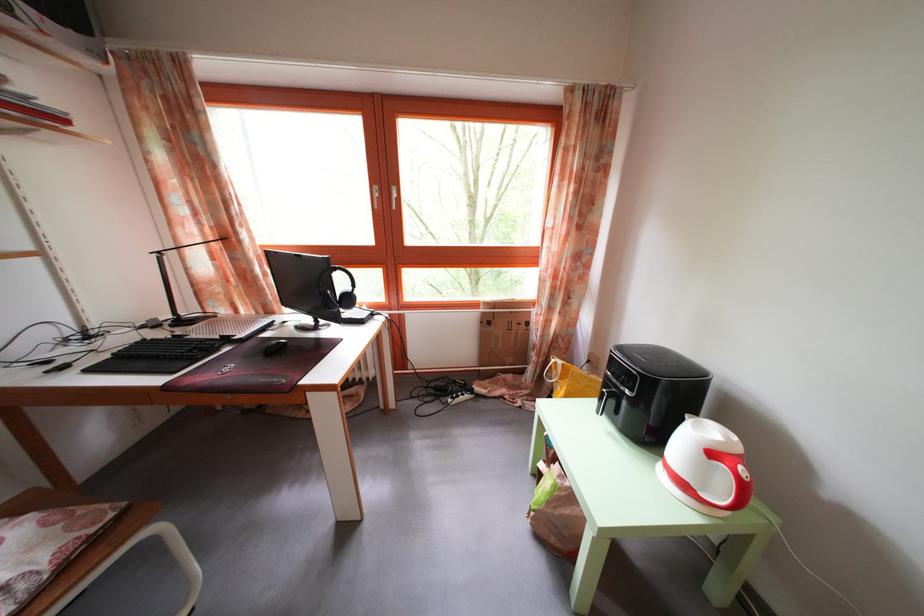
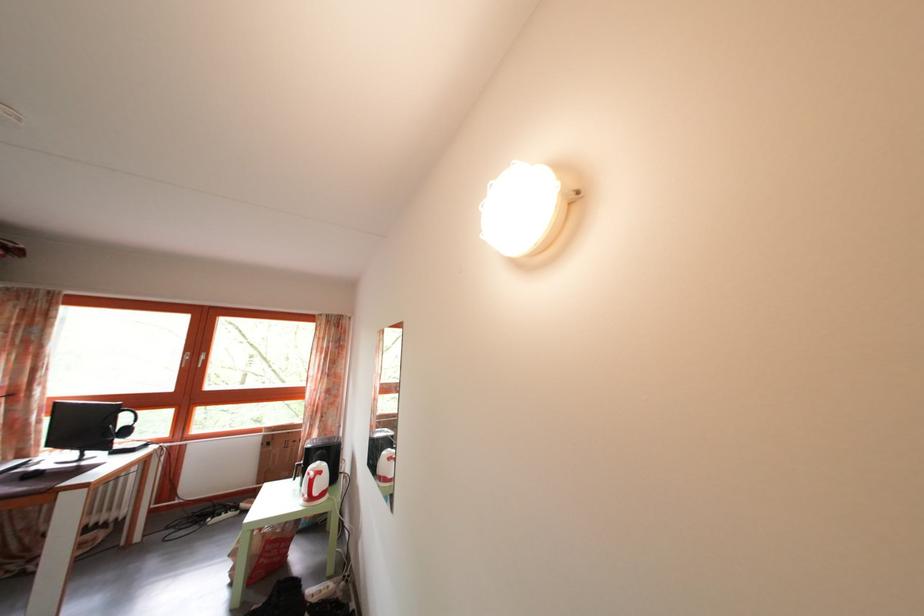
The point at (463, 389) is marked in the first image. Where is the corresponding point in the second image?

(233, 514)